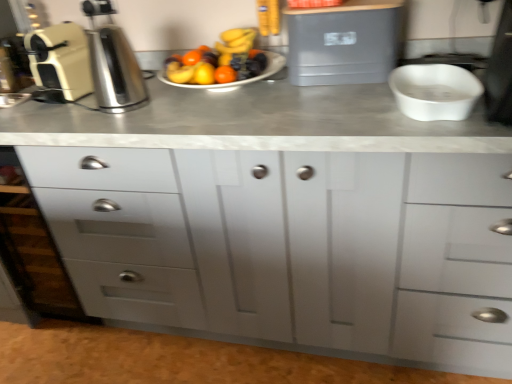
Question: Is satin silver coffee machine at left far away from cream matte coffee machine at left, marked as the 1th appliance in a left-to-right arrangement?

Choices:
 (A) no
 (B) yes

Answer: (A)

Question: Is satin silver coffee machine at left wider than cream matte coffee machine at left, the 2th appliance in the right-to-left sequence?

Choices:
 (A) no
 (B) yes

Answer: (A)

Question: Could you tell me if satin silver coffee machine at left is facing cream matte coffee machine at left, marked as the 1th appliance in a left-to-right arrangement?

Choices:
 (A) no
 (B) yes

Answer: (A)

Question: Can you confirm if satin silver coffee machine at left is shorter than cream matte coffee machine at left, marked as the 1th appliance in a left-to-right arrangement?

Choices:
 (A) yes
 (B) no

Answer: (A)

Question: From the image's perspective, is satin silver coffee machine at left above cream matte coffee machine at left, the 2th appliance in the right-to-left sequence?

Choices:
 (A) yes
 (B) no

Answer: (B)

Question: From a real-world perspective, is gray plastic container at upper center, the 1th appliance positioned from the right, positioned above or below cream matte coffee machine at left, the 2th appliance in the right-to-left sequence?

Choices:
 (A) below
 (B) above

Answer: (A)

Question: In terms of height, does gray plastic container at upper center, the 1th appliance positioned from the right, look taller or shorter compared to cream matte coffee machine at left, the 2th appliance in the right-to-left sequence?

Choices:
 (A) short
 (B) tall

Answer: (A)

Question: Would you say gray plastic container at upper center, the second appliance in the left-to-right sequence, is to the left or to the right of cream matte coffee machine at left, the 2th appliance in the right-to-left sequence, in the picture?

Choices:
 (A) right
 (B) left

Answer: (A)

Question: Based on their sizes in the image, would you say gray plastic container at upper center, the 1th appliance positioned from the right, is bigger or smaller than cream matte coffee machine at left, the 2th appliance in the right-to-left sequence?

Choices:
 (A) small
 (B) big

Answer: (B)

Question: Considering the positions of white glossy mixing bowl at right and cream matte coffee machine at left, the 2th appliance in the right-to-left sequence, in the image, is white glossy mixing bowl at right taller or shorter than cream matte coffee machine at left, the 2th appliance in the right-to-left sequence,?

Choices:
 (A) tall
 (B) short

Answer: (B)

Question: Visually, is white glossy mixing bowl at right positioned to the left or to the right of cream matte coffee machine at left, the 2th appliance in the right-to-left sequence?

Choices:
 (A) right
 (B) left

Answer: (A)

Question: From the image's perspective, relative to cream matte coffee machine at left, marked as the 1th appliance in a left-to-right arrangement, is white glossy mixing bowl at right above or below?

Choices:
 (A) above
 (B) below

Answer: (B)

Question: Is point (466, 74) positioned closer to the camera than point (50, 102)?

Choices:
 (A) farther
 (B) closer

Answer: (B)

Question: Is gray plastic container at upper center, the second appliance in the left-to-right sequence, inside the boundaries of white matte drawer at left, or outside?

Choices:
 (A) outside
 (B) inside

Answer: (A)

Question: Does point (400, 26) appear closer or farther from the camera than point (97, 170)?

Choices:
 (A) farther
 (B) closer

Answer: (A)